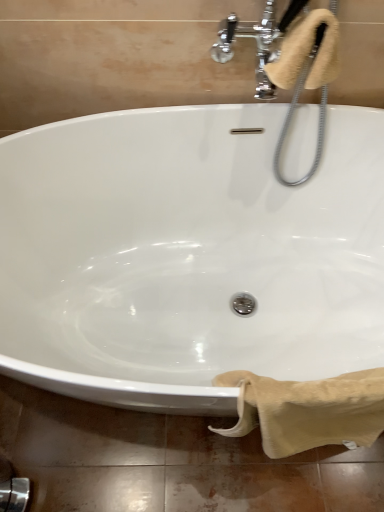
Question: Is beige soft towel at upper right, the second bath towel positioned from the bottom, oriented away from beige cotton towel at lower right, which is the second bath towel in top-to-bottom order?

Choices:
 (A) no
 (B) yes

Answer: (A)

Question: Is beige soft towel at upper right, the second bath towel positioned from the bottom, behind beige cotton towel at lower right, arranged as the 1th bath towel when ordered from the bottom?

Choices:
 (A) no
 (B) yes

Answer: (B)

Question: Is beige soft towel at upper right, which is the first bath towel from top to bottom, far away from beige cotton towel at lower right, arranged as the 1th bath towel when ordered from the bottom?

Choices:
 (A) no
 (B) yes

Answer: (A)

Question: Is beige soft towel at upper right, which is the first bath towel from top to bottom, wider than beige cotton towel at lower right, arranged as the 1th bath towel when ordered from the bottom?

Choices:
 (A) no
 (B) yes

Answer: (B)

Question: Can you confirm if beige soft towel at upper right, which is the first bath towel from top to bottom, is positioned to the right of beige cotton towel at lower right, which is the second bath towel in top-to-bottom order?

Choices:
 (A) no
 (B) yes

Answer: (A)

Question: From a real-world perspective, is beige soft towel at upper right, the second bath towel positioned from the bottom, on top of beige cotton towel at lower right, which is the second bath towel in top-to-bottom order?

Choices:
 (A) no
 (B) yes

Answer: (B)

Question: Does beige cotton towel at lower right, which is the second bath towel in top-to-bottom order, have a lesser width compared to beige soft towel at upper right, the second bath towel positioned from the bottom?

Choices:
 (A) yes
 (B) no

Answer: (A)

Question: Can you confirm if beige cotton towel at lower right, arranged as the 1th bath towel when ordered from the bottom, is bigger than beige soft towel at upper right, which is the first bath towel from top to bottom?

Choices:
 (A) yes
 (B) no

Answer: (A)

Question: Considering the relative sizes of beige cotton towel at lower right, arranged as the 1th bath towel when ordered from the bottom, and beige soft towel at upper right, which is the first bath towel from top to bottom, in the image provided, is beige cotton towel at lower right, arranged as the 1th bath towel when ordered from the bottom, smaller than beige soft towel at upper right, which is the first bath towel from top to bottom,?

Choices:
 (A) no
 (B) yes

Answer: (A)

Question: Is beige cotton towel at lower right, which is the second bath towel in top-to-bottom order, beside beige soft towel at upper right, the second bath towel positioned from the bottom?

Choices:
 (A) no
 (B) yes

Answer: (A)

Question: Considering the relative positions of beige cotton towel at lower right, arranged as the 1th bath towel when ordered from the bottom, and beige soft towel at upper right, which is the first bath towel from top to bottom, in the image provided, is beige cotton towel at lower right, arranged as the 1th bath towel when ordered from the bottom, to the left of beige soft towel at upper right, which is the first bath towel from top to bottom, from the viewer's perspective?

Choices:
 (A) no
 (B) yes

Answer: (A)

Question: From a real-world perspective, does beige cotton towel at lower right, arranged as the 1th bath towel when ordered from the bottom, stand above beige soft towel at upper right, which is the first bath towel from top to bottom?

Choices:
 (A) yes
 (B) no

Answer: (B)

Question: Is beige soft towel at upper right, which is the first bath towel from top to bottom, to the left or to the right of beige cotton towel at lower right, arranged as the 1th bath towel when ordered from the bottom, in the image?

Choices:
 (A) left
 (B) right

Answer: (A)